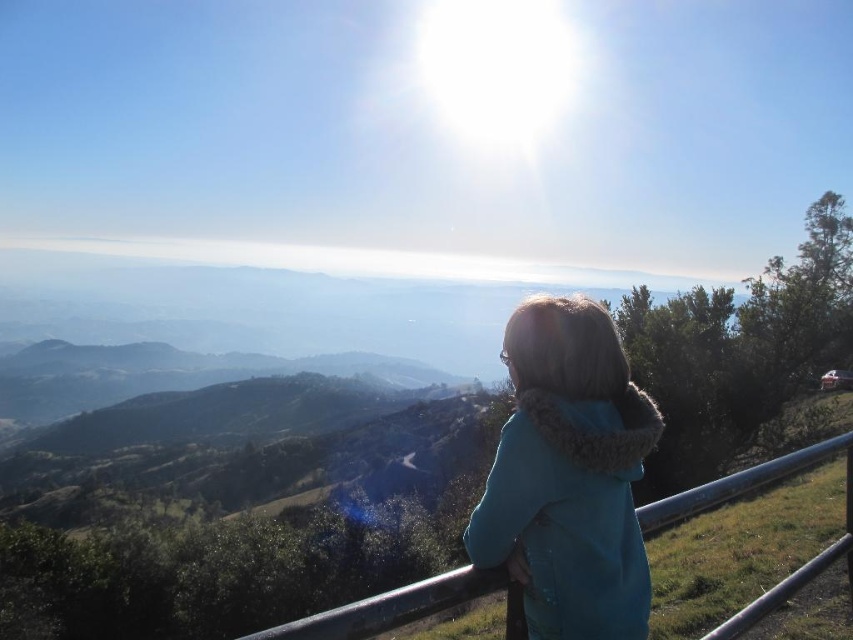
Question: Is teal fur-trimmed coat at center below metallic rail at lower right?

Choices:
 (A) no
 (B) yes

Answer: (A)

Question: Which of the following is the farthest from the observer?

Choices:
 (A) (788, 464)
 (B) (602, 348)

Answer: (A)

Question: Is teal fur-trimmed coat at center wider than metallic rail at lower right?

Choices:
 (A) no
 (B) yes

Answer: (A)

Question: Does teal fur-trimmed coat at center appear under metallic rail at lower right?

Choices:
 (A) yes
 (B) no

Answer: (B)